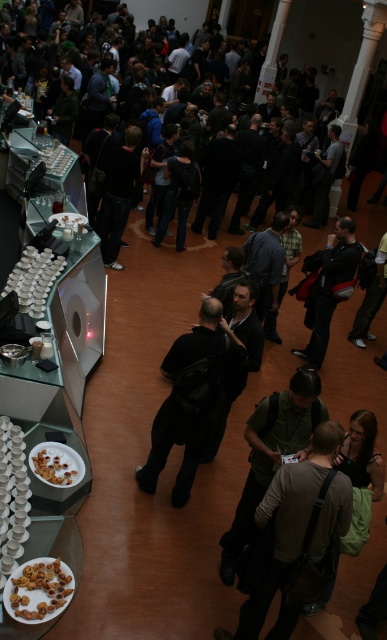
Identify the location of dark gray backpack at center. (330, 288).

Which is below, dark gray backpack at center or golden crumbly pastry at lower left?

Positioned lower is golden crumbly pastry at lower left.

What do you see at coordinates (330, 288) in the screenshot? I see `dark gray backpack at center` at bounding box center [330, 288].

The image size is (387, 640). Identify the location of dark gray backpack at center. (330, 288).

Can you confirm if black matte backpack at center is positioned below golden crumbly pastry at lower left?

Actually, black matte backpack at center is above golden crumbly pastry at lower left.

Is black matte backpack at center wider than golden crumbly pastry at lower left?

Yes, black matte backpack at center is wider than golden crumbly pastry at lower left.

Between point (203, 432) and point (39, 454), which one is positioned in front?

Point (39, 454)

At what (x,y) coordinates should I click in order to perform the action: click on black matte backpack at center. Please return your answer as a coordinate pair (x, y). The height and width of the screenshot is (640, 387). Looking at the image, I should click on (181, 404).

Can you confirm if black matte backpack at center is taller than brown matte nuts at lower left?

Indeed, black matte backpack at center has a greater height compared to brown matte nuts at lower left.

This screenshot has height=640, width=387. What do you see at coordinates (181, 404) in the screenshot? I see `black matte backpack at center` at bounding box center [181, 404].

Is point (181, 355) farther from camera compared to point (34, 605)?

Yes, it is.

This screenshot has width=387, height=640. Identify the location of black matte backpack at center. (181, 404).